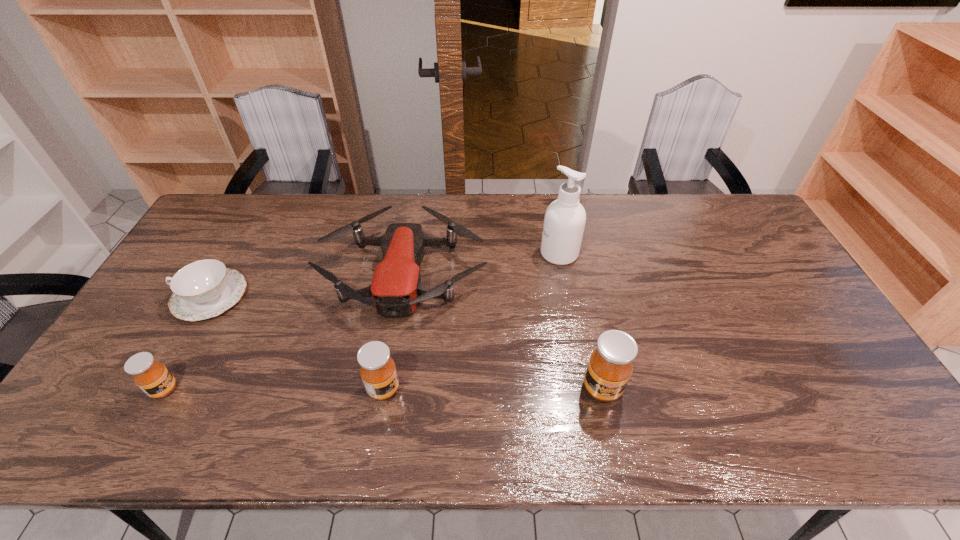
Image resolution: width=960 pixels, height=540 pixels. I want to click on vacant space at the left edge of the desktop, so click(x=227, y=248).

At what (x,y) coordinates should I click in order to perform the action: click on free region at the far right corner of the desktop. Please return your answer as a coordinate pair (x, y). The image size is (960, 540). Looking at the image, I should click on (756, 228).

The image size is (960, 540). In order to click on vacant point located between the chinaware and the drone in this screenshot , I will do `click(307, 285)`.

Where is `empty space that is in between the fifth shortest object and the cleansing agent`? Image resolution: width=960 pixels, height=540 pixels. empty space that is in between the fifth shortest object and the cleansing agent is located at coordinates (581, 321).

Where is `unoccupied area between the shortest honey and the drone`? unoccupied area between the shortest honey and the drone is located at coordinates (284, 331).

I want to click on empty location between the fourth shortest object and the drone, so click(394, 331).

At what (x,y) coordinates should I click in order to perform the action: click on free space between the tallest honey and the second shortest honey. Please return your answer as a coordinate pair (x, y). This screenshot has width=960, height=540. Looking at the image, I should click on (492, 388).

Identify the location of unoccupied area between the fourth shortest object and the drone. This screenshot has height=540, width=960. (394, 331).

The width and height of the screenshot is (960, 540). Find the location of `free space that is in between the cleansing agent and the leftmost honey`. free space that is in between the cleansing agent and the leftmost honey is located at coordinates (362, 321).

Image resolution: width=960 pixels, height=540 pixels. I want to click on free spot between the tallest honey and the tallest object, so [581, 321].